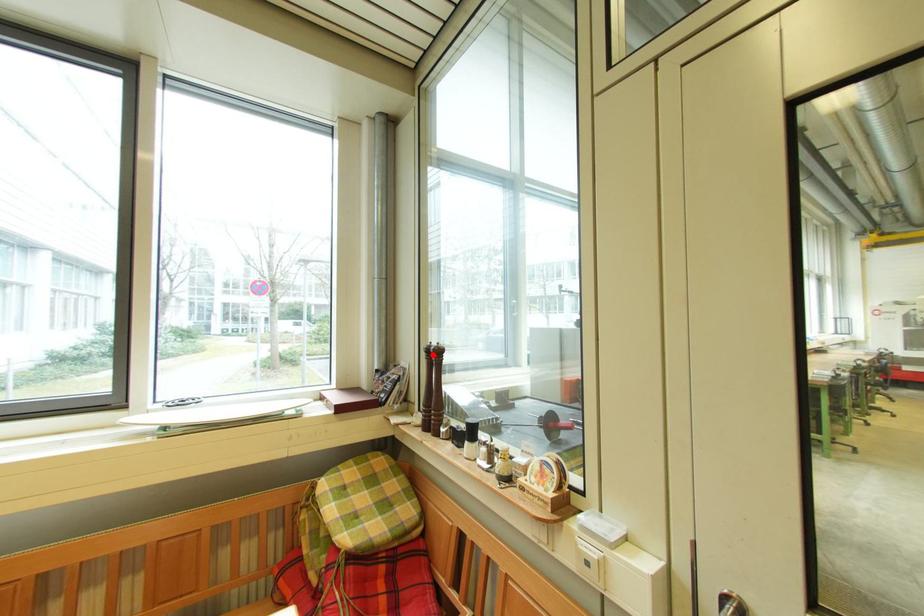
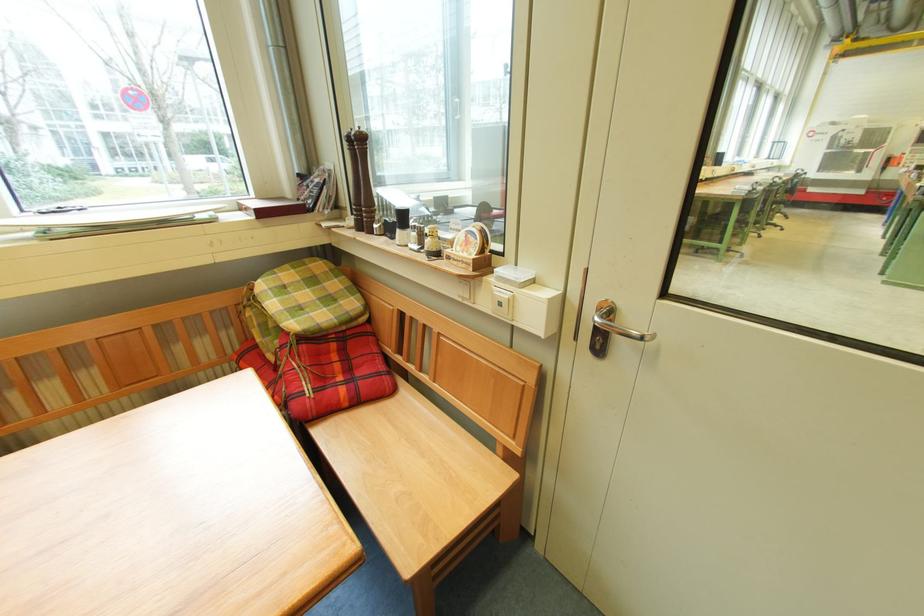
Question: I am providing you with two images of the same scene from different viewpoints. In image1, a red point is highlighted. Considering the same 3D point in image2, which of the following is correct?

Choices:
 (A) It is closer
 (B) It is farther

Answer: (A)